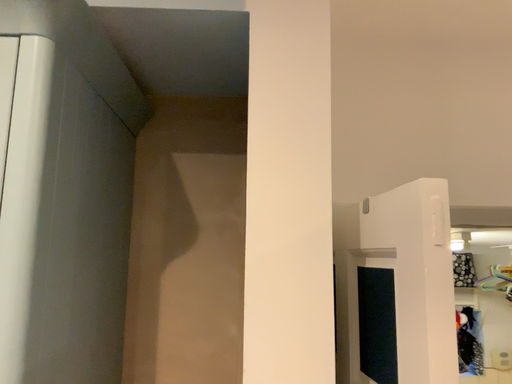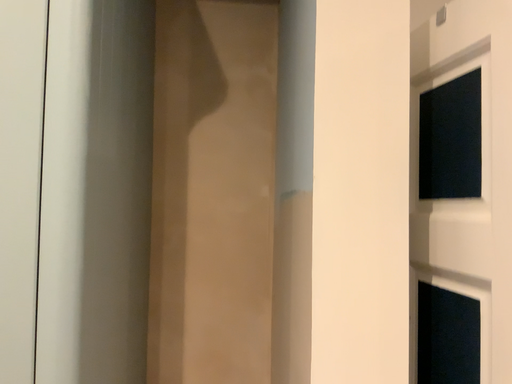
Question: How did the camera likely rotate when shooting the video?

Choices:
 (A) rotated upward
 (B) rotated downward

Answer: (B)